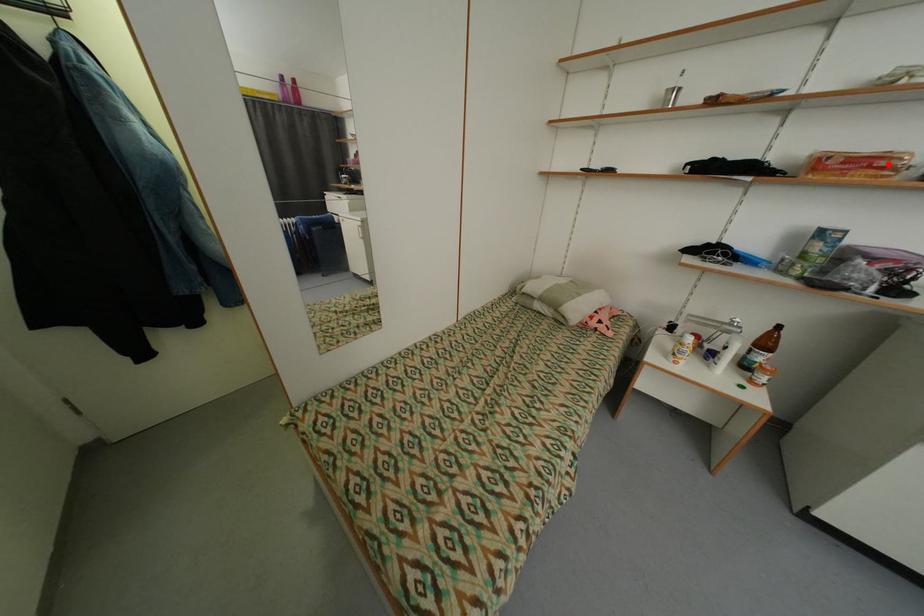
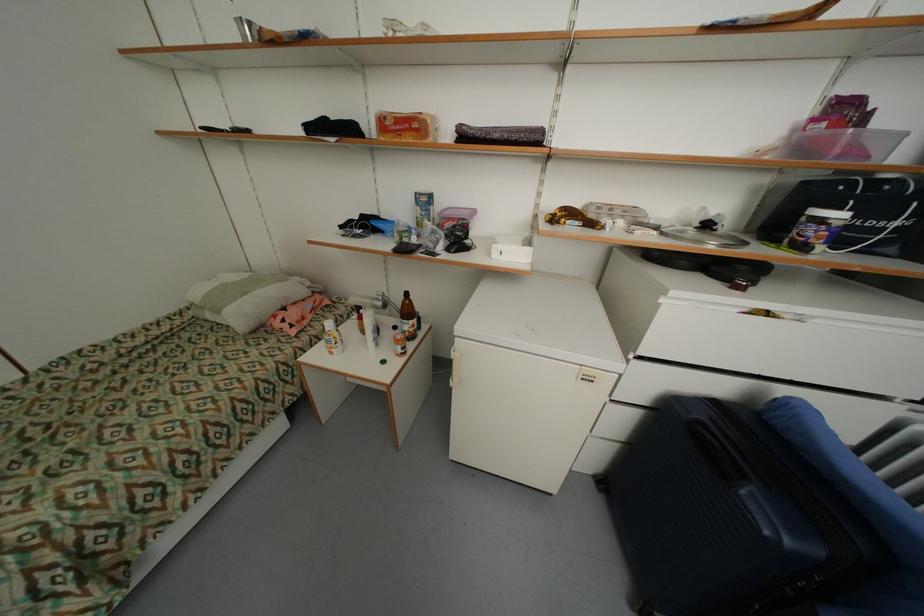
Question: I am providing you with two images of the same scene from different viewpoints. In image1, a red point is highlighted. Considering the same 3D point in image2, which of the following is correct?

Choices:
 (A) It is closer
 (B) It is farther

Answer: (A)